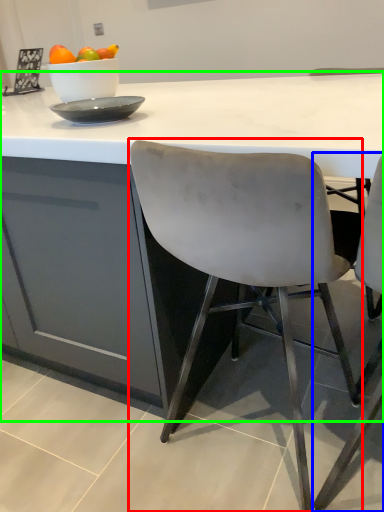
Question: Which is farther away from chair (highlighted by a red box)? chair (highlighted by a blue box) or table (highlighted by a green box)?

Choices:
 (A) chair
 (B) table

Answer: (A)